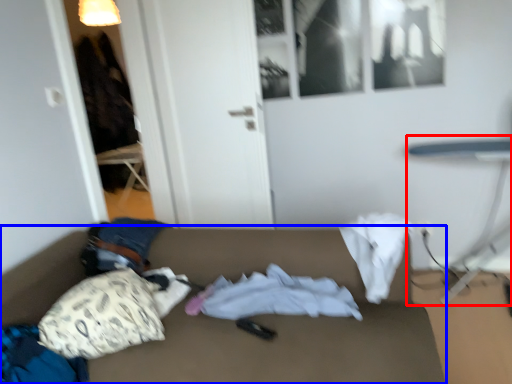
Question: Which point is further to the camera, table (highlighted by a red box) or studio couch (highlighted by a blue box)?

Choices:
 (A) table
 (B) studio couch

Answer: (A)